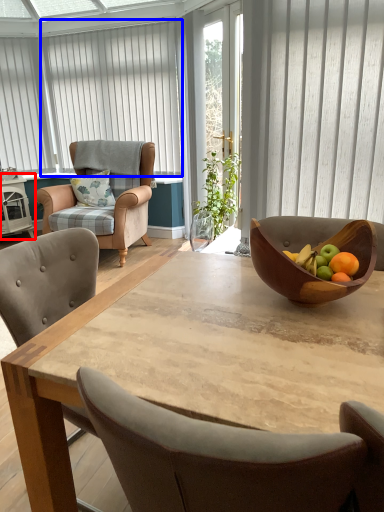
Question: Which object is further to the camera taking this photo, side table (highlighted by a red box) or curtain (highlighted by a blue box)?

Choices:
 (A) side table
 (B) curtain

Answer: (A)